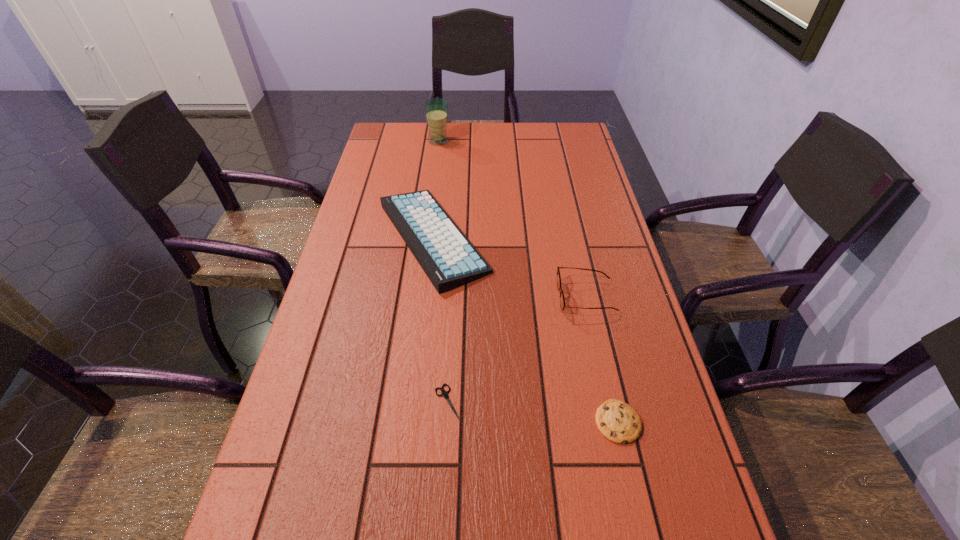
Identify the location of vacant space located 0.110m on the back of the computer keyboard. The width and height of the screenshot is (960, 540). (441, 173).

I want to click on vacant space located on the right of the second shortest object, so click(x=671, y=422).

Locate an element on the screen. vacant space located 0.300m on the left of the shortest object is located at coordinates point(287,402).

At what (x,y) coordinates should I click in order to perform the action: click on object at the far edge. Please return your answer as a coordinate pair (x, y). This screenshot has width=960, height=540. Looking at the image, I should click on (436, 109).

Image resolution: width=960 pixels, height=540 pixels. Identify the location of object located in the left edge section of the desktop. (448, 258).

Where is `spectacles present at the right edge`? The height and width of the screenshot is (540, 960). spectacles present at the right edge is located at coordinates (562, 300).

Find the location of a particular element. cookie present at the right edge is located at coordinates tap(617, 421).

Image resolution: width=960 pixels, height=540 pixels. In the image, there is a desktop. Identify the location of vacant space at the far edge. (525, 134).

Locate an element on the screen. The height and width of the screenshot is (540, 960). vacant region at the left edge of the desktop is located at coordinates (330, 278).

This screenshot has height=540, width=960. In the image, there is a desktop. Find the location of `vacant space at the right edge`. vacant space at the right edge is located at coordinates (564, 176).